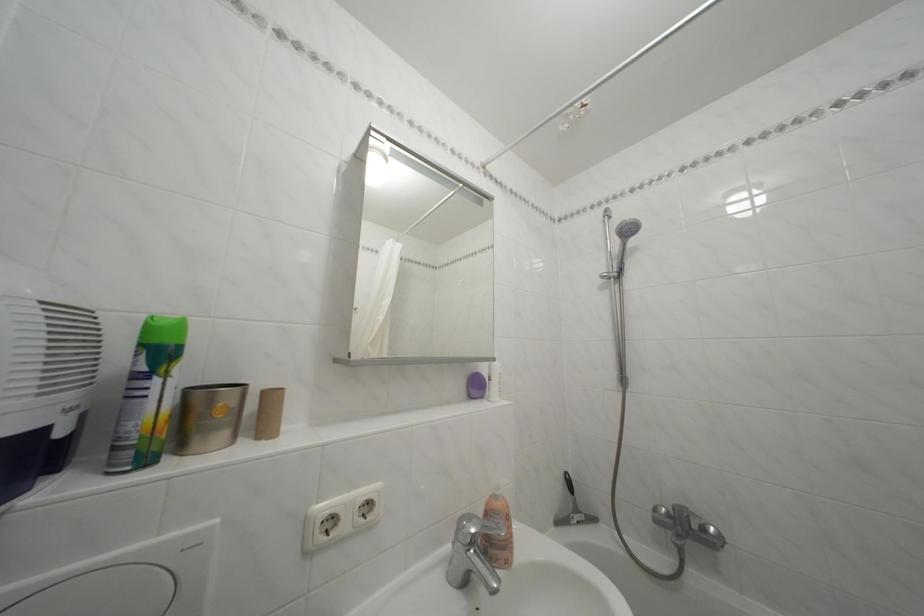
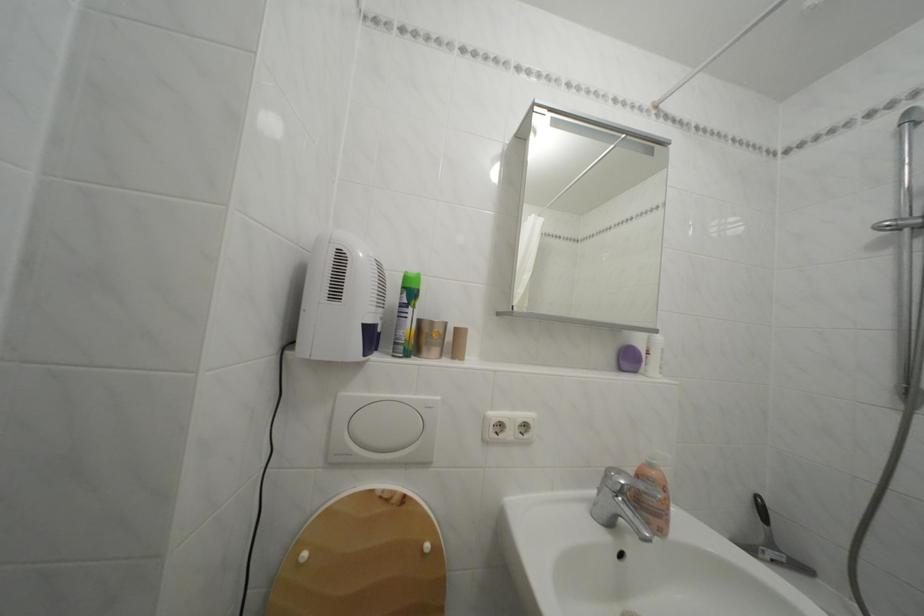
Question: The images are taken continuously from a first-person perspective. In which direction is your viewpoint rotating?

Choices:
 (A) Left
 (B) Right
 (C) Up
 (D) Down

Answer: (A)